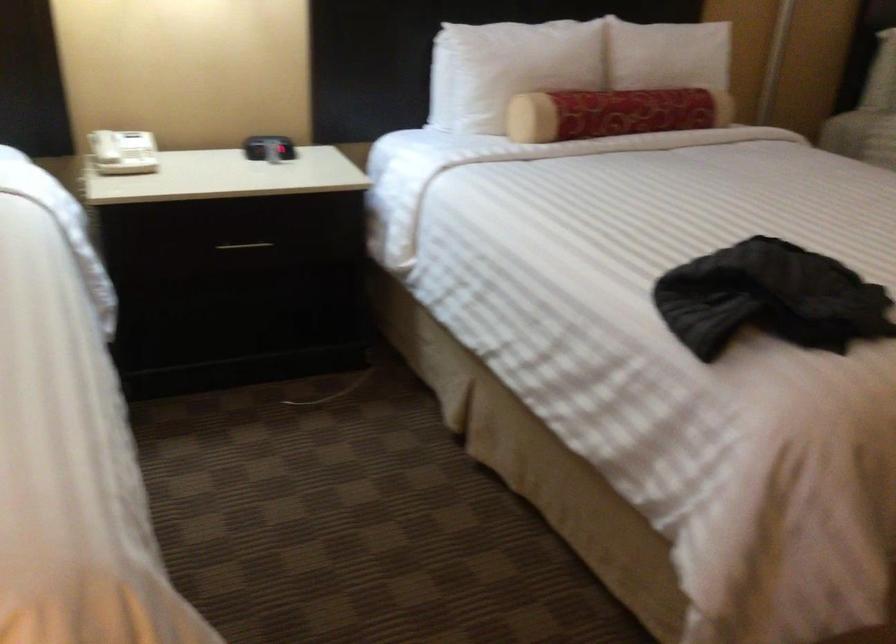
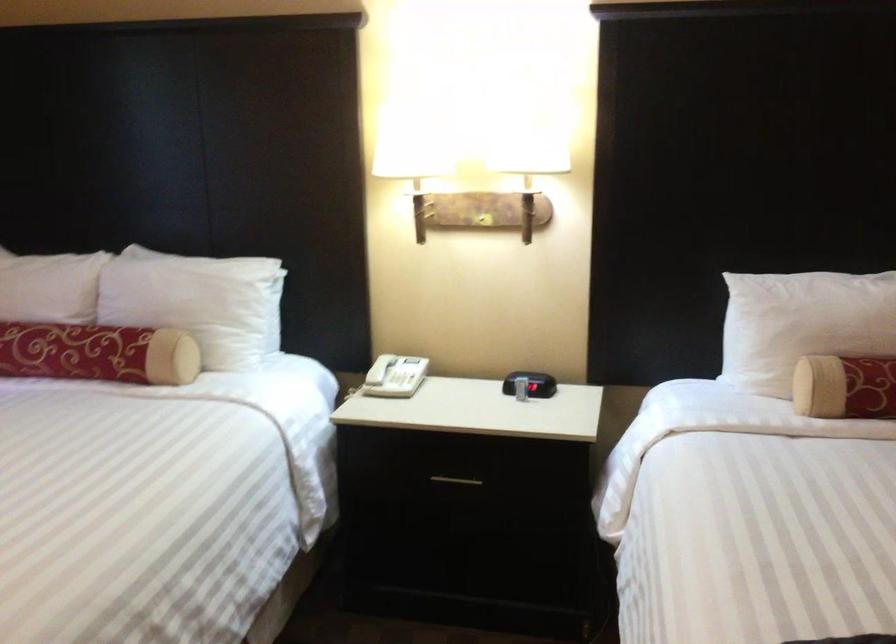
Locate, in the second image, the point that corresponds to point 561,118 in the first image.

(845, 386)